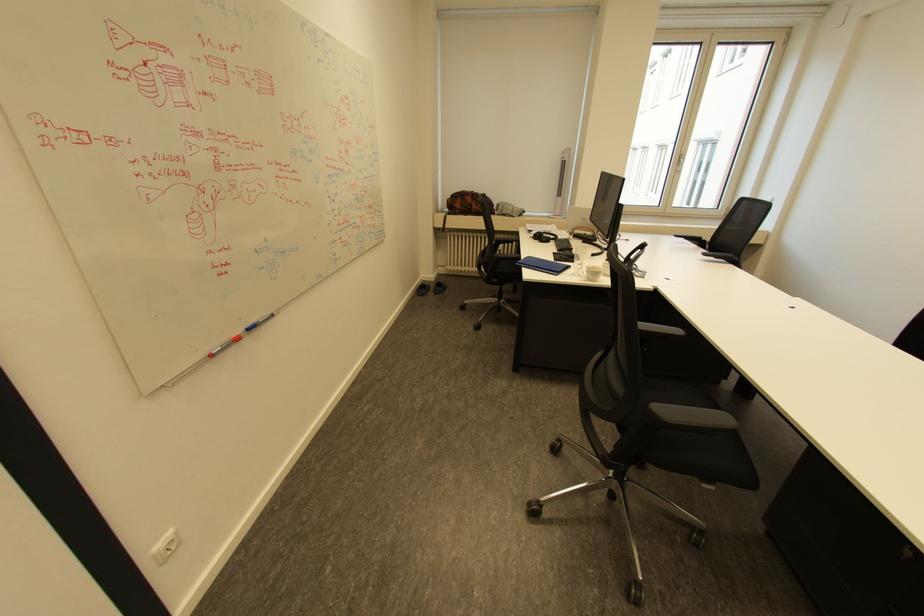
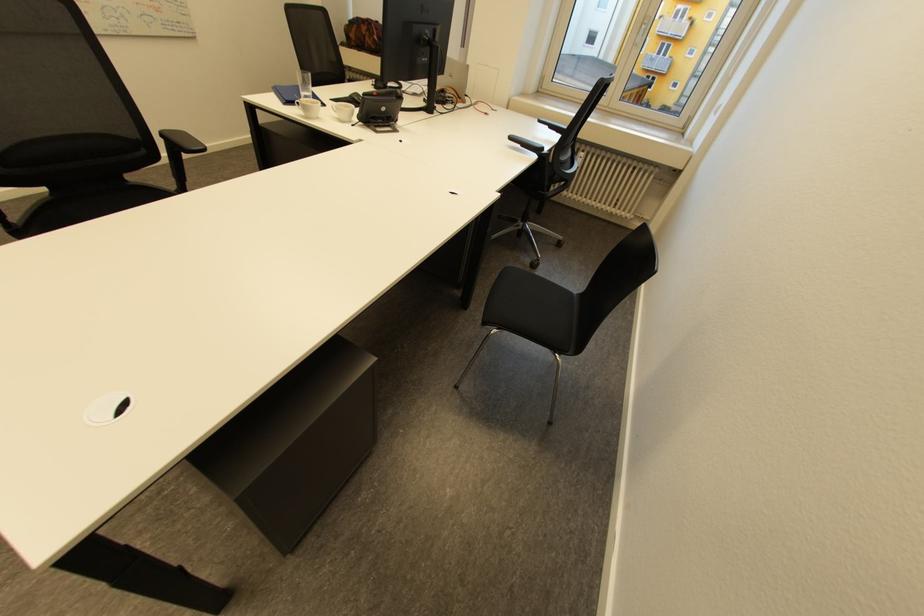
Question: Which direction would the cameraman need to move to produce the second image? Reply with the corresponding letter.

Choices:
 (A) Left
 (B) Right
 (C) Forward
 (D) Backward

Answer: (B)